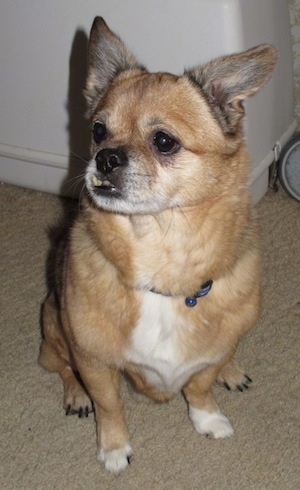
I want to click on carpet, so click(200, 471).